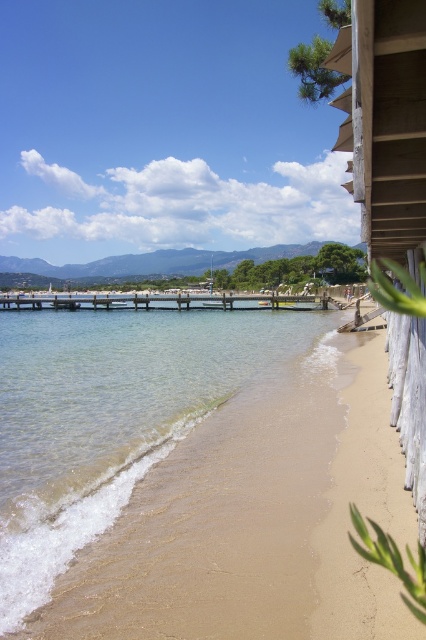
Question: Which point is farther to the camera?

Choices:
 (A) (192, 301)
 (B) (62, 436)

Answer: (A)

Question: Can you confirm if clear water at lower left is smaller than wooden pier at center?

Choices:
 (A) yes
 (B) no

Answer: (B)

Question: Which object is closer to the camera taking this photo?

Choices:
 (A) wooden pier at center
 (B) clear water at lower left

Answer: (B)

Question: Is clear water at lower left wider than wooden pier at center?

Choices:
 (A) no
 (B) yes

Answer: (A)

Question: Observing the image, what is the correct spatial positioning of clear water at lower left in reference to wooden pier at center?

Choices:
 (A) right
 (B) left

Answer: (A)